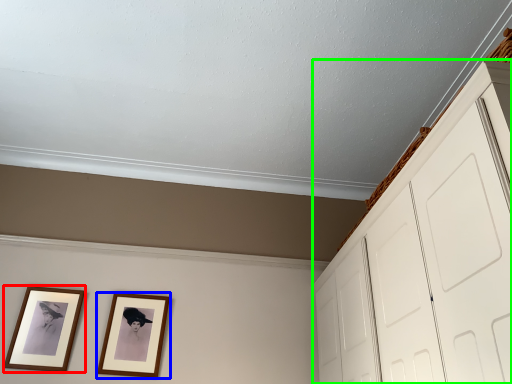
Question: Which object is the farthest from picture frame (highlighted by a red box)? Choose among these: picture frame (highlighted by a blue box) or dresser (highlighted by a green box).

Choices:
 (A) picture frame
 (B) dresser

Answer: (B)